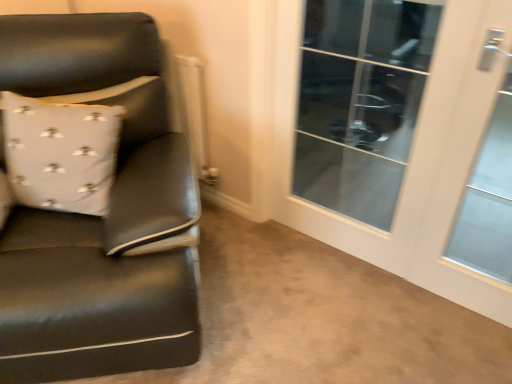
Question: Considering the relative sizes of white textured pillow at left and transparent glass door at upper right in the image provided, is white textured pillow at left thinner than transparent glass door at upper right?

Choices:
 (A) no
 (B) yes

Answer: (A)

Question: Is white textured pillow at left closer to the viewer compared to transparent glass door at upper right?

Choices:
 (A) no
 (B) yes

Answer: (B)

Question: Is white textured pillow at left not within transparent glass door at upper right?

Choices:
 (A) yes
 (B) no

Answer: (A)

Question: Does white textured pillow at left have a greater width compared to transparent glass door at upper right?

Choices:
 (A) yes
 (B) no

Answer: (A)

Question: Considering the relative sizes of white textured pillow at left and transparent glass door at upper right in the image provided, is white textured pillow at left smaller than transparent glass door at upper right?

Choices:
 (A) no
 (B) yes

Answer: (A)

Question: Is transparent glass door at upper right in front of or behind white glossy door at right, arranged as the second screen door when viewed from the left, in the image?

Choices:
 (A) behind
 (B) front

Answer: (A)

Question: Considering the positions of transparent glass door at upper right and white glossy door at right, which is counted as the first screen door, starting from the right, in the image, is transparent glass door at upper right bigger or smaller than white glossy door at right, which is counted as the first screen door, starting from the right,?

Choices:
 (A) small
 (B) big

Answer: (A)

Question: In terms of height, does transparent glass door at upper right look taller or shorter compared to white glossy door at right, which is counted as the first screen door, starting from the right?

Choices:
 (A) tall
 (B) short

Answer: (B)

Question: Is transparent glass door at upper right situated inside white glossy door at right, which is counted as the first screen door, starting from the right, or outside?

Choices:
 (A) inside
 (B) outside

Answer: (B)

Question: Considering the positions of transparent glass door at upper right and white textured pillow at left in the image, is transparent glass door at upper right wider or thinner than white textured pillow at left?

Choices:
 (A) thin
 (B) wide

Answer: (A)

Question: In terms of height, does transparent glass door at upper right look taller or shorter compared to white textured pillow at left?

Choices:
 (A) tall
 (B) short

Answer: (A)

Question: From a real-world perspective, is transparent glass door at upper right positioned above or below white textured pillow at left?

Choices:
 (A) above
 (B) below

Answer: (B)

Question: Is transparent glass door at upper right bigger or smaller than white textured pillow at left?

Choices:
 (A) small
 (B) big

Answer: (A)

Question: Considering the positions of point (90, 339) and point (468, 51), is point (90, 339) closer or farther from the camera than point (468, 51)?

Choices:
 (A) closer
 (B) farther

Answer: (A)

Question: Is matte black leather chair at left bigger or smaller than white glossy door at right, arranged as the second screen door when viewed from the left?

Choices:
 (A) big
 (B) small

Answer: (A)